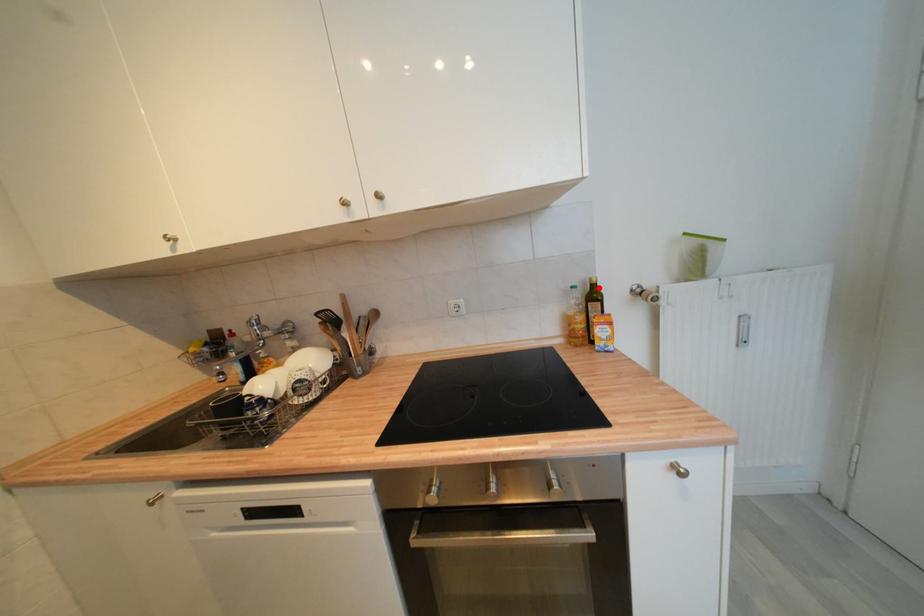
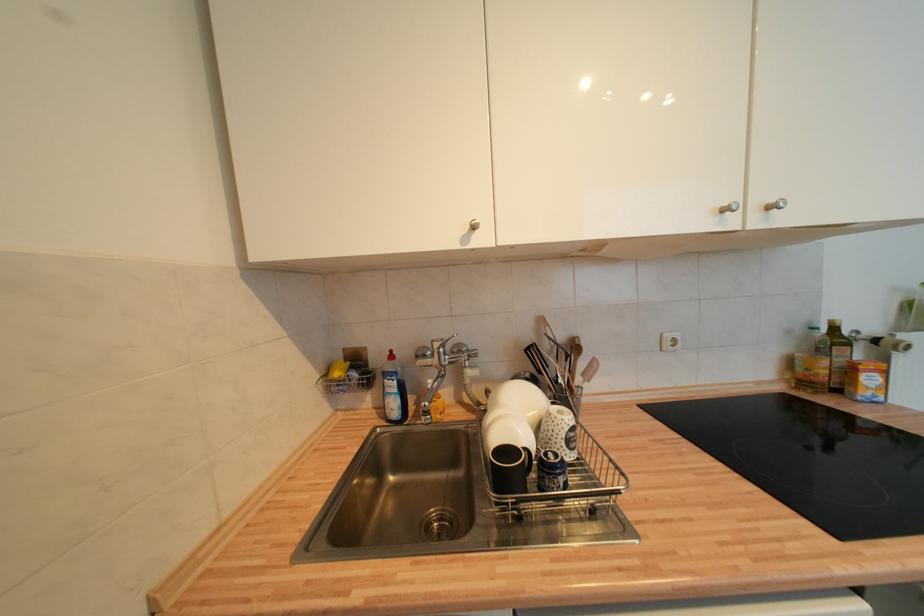
In the second image, find the point that corresponds to the highlighted location in the first image.

(840, 331)